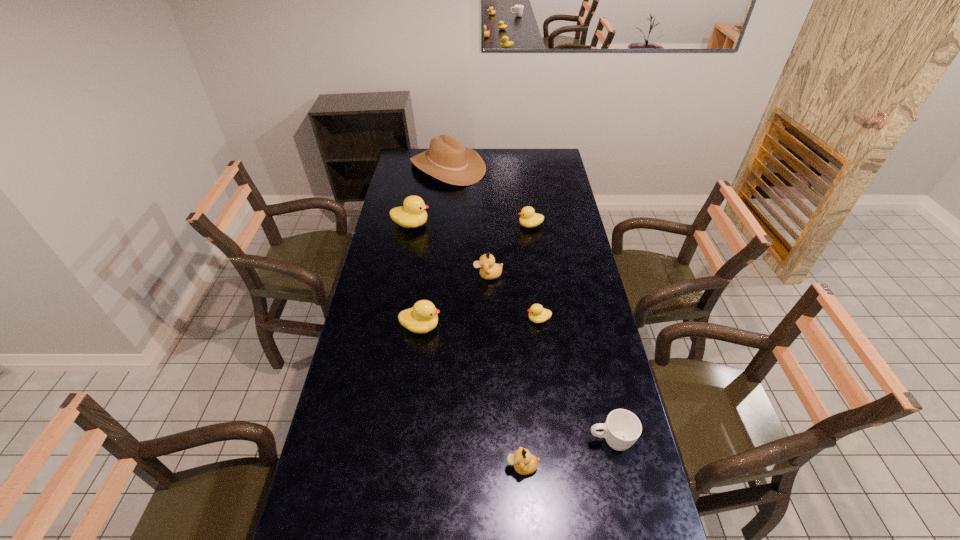
Where is `object located at the far edge`? This screenshot has width=960, height=540. object located at the far edge is located at coordinates (447, 159).

Where is `cowboy hat that is positioned at the left edge`? cowboy hat that is positioned at the left edge is located at coordinates (447, 159).

Find the location of a particular element. duckling that is positioned at the right edge is located at coordinates (530, 219).

At what (x,y) coordinates should I click in order to perform the action: click on cup located in the right edge section of the desktop. Please return your answer as a coordinate pair (x, y). This screenshot has height=540, width=960. Looking at the image, I should click on (622, 428).

Find the location of a particular element. object situated at the far left corner is located at coordinates (447, 159).

This screenshot has width=960, height=540. I want to click on vacant space at the far edge of the desktop, so click(528, 154).

Locate an element on the screen. The image size is (960, 540). vacant space at the left edge of the desktop is located at coordinates (389, 212).

In the image, there is a desktop. Identify the location of vacant space at the right edge. (574, 264).

You are a GUI agent. You are given a task and a screenshot of the screen. Output one action in this format:
    pyautogui.click(x=<x>, y=<y>)
    Task: Click on the free location at the far right corner
    The width and height of the screenshot is (960, 540).
    Given the screenshot: What is the action you would take?
    pyautogui.click(x=542, y=161)

Where is `free point between the bigger tan duckling and the rightmost object`? This screenshot has width=960, height=540. free point between the bigger tan duckling and the rightmost object is located at coordinates (549, 358).